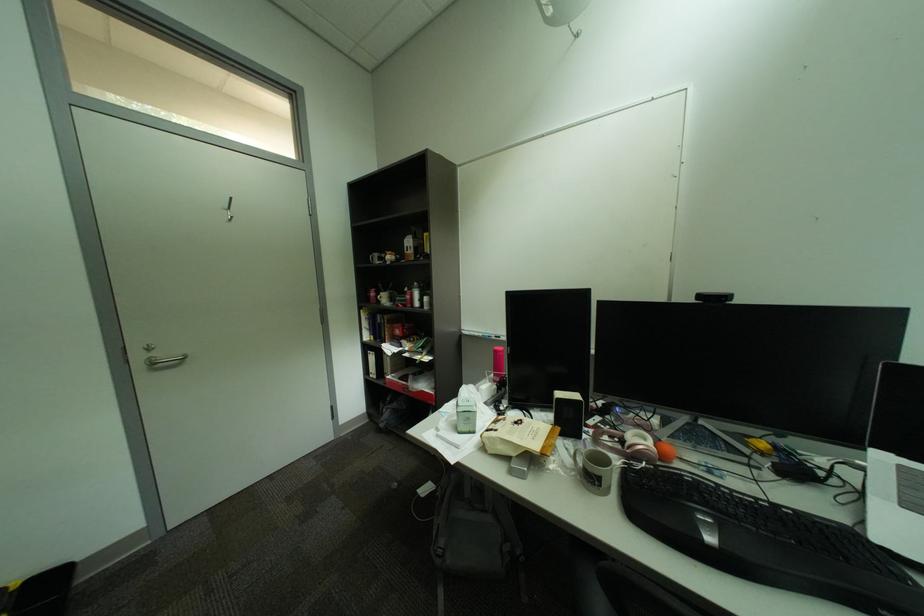
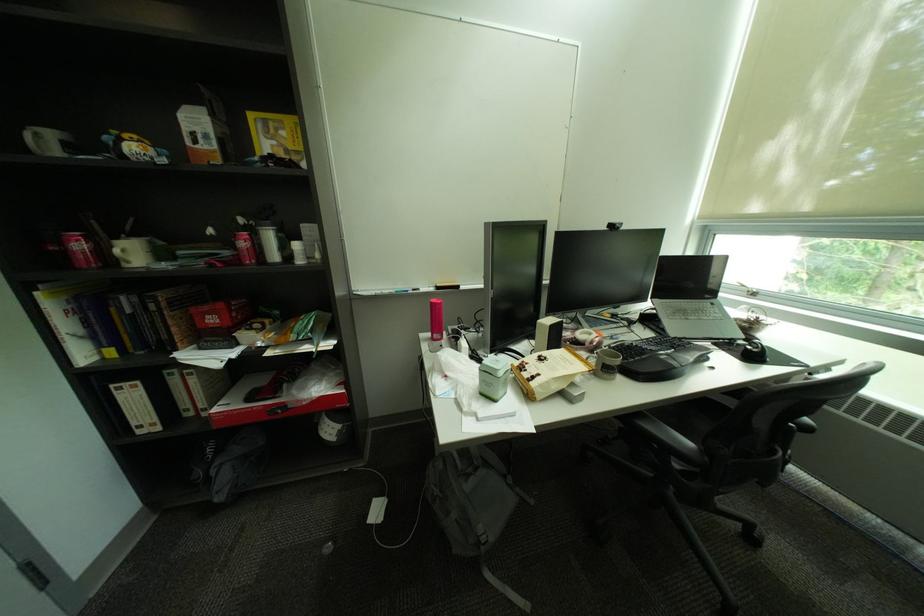
Question: I am providing you with two images of the same scene from different viewpoints. Which of the following objects are not visible in image2?

Choices:
 (A) black window latch
 (B) green metal tin
 (C) black computer mouse
 (D) none of these

Answer: (D)